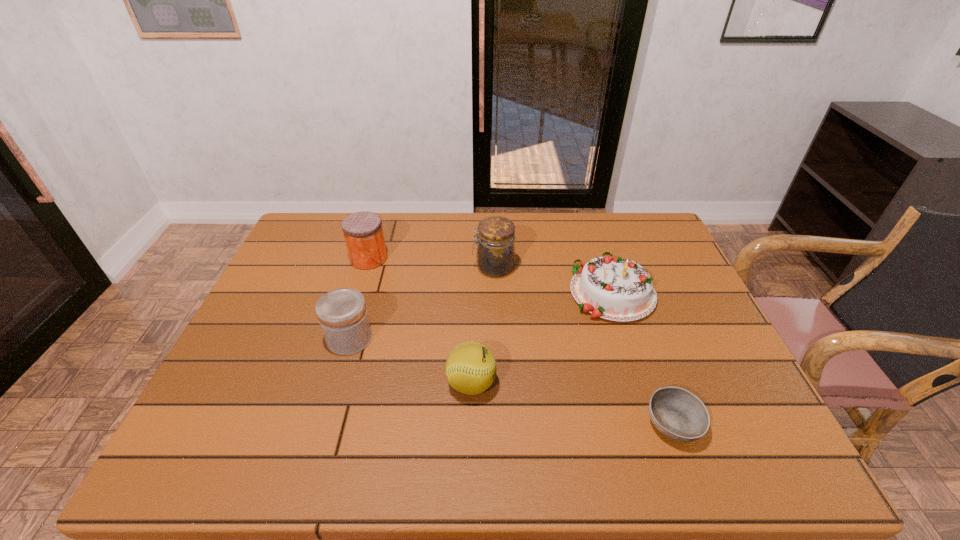
You are a GUI agent. You are given a task and a screenshot of the screen. Output one action in this format:
    pyautogui.click(x=<x>, y=<y>)
    Task: Click on the vacant space located on the logo side of the softball
    
    Given the screenshot: What is the action you would take?
    pyautogui.click(x=620, y=383)

In order to click on blank space located on the back of the bowl in this screenshot , I will do `click(640, 333)`.

You are a GUI agent. You are given a task and a screenshot of the screen. Output one action in this format:
    pyautogui.click(x=<x>, y=<y>)
    Task: Click on the object present at the far edge
    The width and height of the screenshot is (960, 540).
    Given the screenshot: What is the action you would take?
    pyautogui.click(x=363, y=232)

Find the location of a particular element. The width and height of the screenshot is (960, 540). object present at the near edge is located at coordinates (676, 413).

This screenshot has height=540, width=960. Find the location of `cake that is at the right edge`. cake that is at the right edge is located at coordinates (614, 289).

Image resolution: width=960 pixels, height=540 pixels. In order to click on bowl present at the right edge in this screenshot , I will do [676, 413].

This screenshot has height=540, width=960. Find the location of `object at the near right corner`. object at the near right corner is located at coordinates (676, 413).

Where is `vacant space at the far edge of the desktop`? The width and height of the screenshot is (960, 540). vacant space at the far edge of the desktop is located at coordinates (414, 234).

You are a GUI agent. You are given a task and a screenshot of the screen. Output one action in this format:
    pyautogui.click(x=<x>, y=<y>)
    Task: Click on the vacant space at the near edge
    
    Given the screenshot: What is the action you would take?
    pyautogui.click(x=276, y=453)

Find the location of a particular element. Image resolution: width=960 pixels, height=540 pixels. free location at the left edge of the desktop is located at coordinates (300, 308).